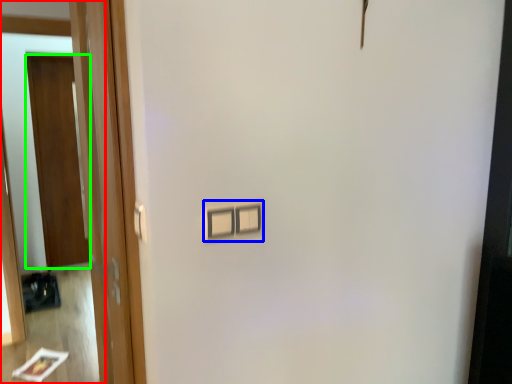
Question: Considering the real-world distances, which object is closest to mirror (highlighted by a red box)? light switch (highlighted by a blue box) or door (highlighted by a green box).

Choices:
 (A) light switch
 (B) door

Answer: (B)